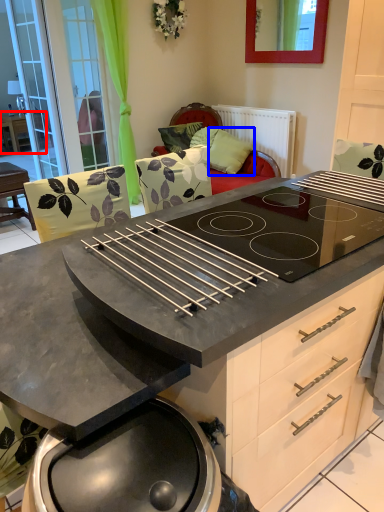
Question: Which point is further to the camera, table (highlighted by a red box) or pillow (highlighted by a blue box)?

Choices:
 (A) table
 (B) pillow

Answer: (A)